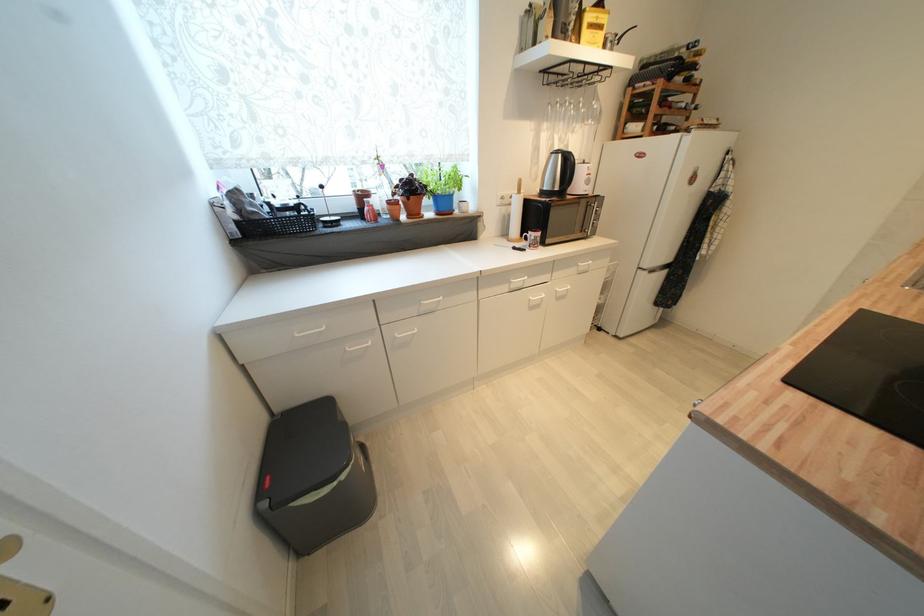
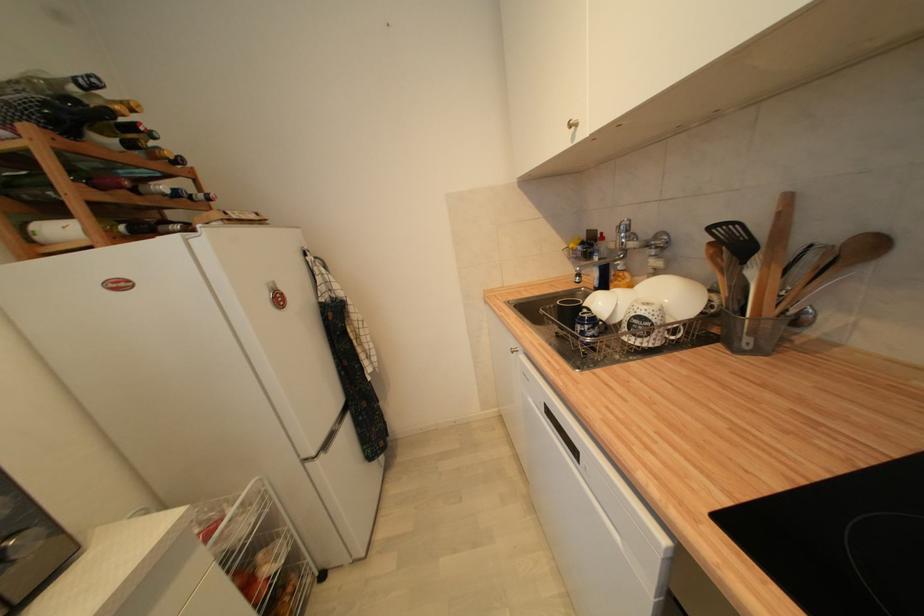
Locate, in the second image, the point that corresponds to pixel 700 110 in the first image.

(213, 200)